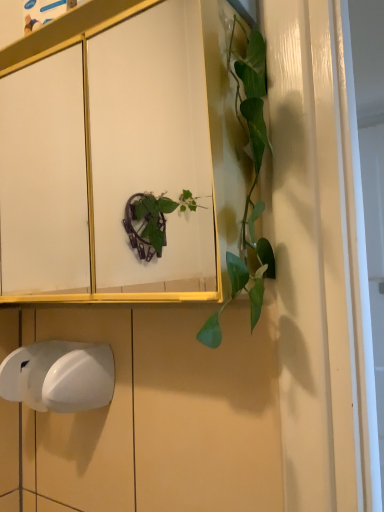
I want to click on white plastic hand dryer at lower left, so click(59, 376).

Describe the element at coordinates (59, 376) in the screenshot. I see `white plastic hand dryer at lower left` at that location.

What do you see at coordinates (108, 162) in the screenshot? I see `white glossy cabinet at upper center` at bounding box center [108, 162].

Locate an element on the screen. The image size is (384, 512). white glossy cabinet at upper center is located at coordinates (108, 162).

Find the location of `white plastic hand dryer at lower left`. white plastic hand dryer at lower left is located at coordinates (x=59, y=376).

Considering the relative positions of white glossy cabinet at upper center and white plastic hand dryer at lower left in the image provided, is white glossy cabinet at upper center to the left of white plastic hand dryer at lower left from the viewer's perspective?

No, white glossy cabinet at upper center is not to the left of white plastic hand dryer at lower left.

Considering the relative positions of white glossy cabinet at upper center and white plastic hand dryer at lower left in the image provided, is white glossy cabinet at upper center in front of white plastic hand dryer at lower left?

Yes, the depth of white glossy cabinet at upper center is less than that of white plastic hand dryer at lower left.

Is point (94, 34) behind point (48, 393)?

No, it is not.

From the image's perspective, is white glossy cabinet at upper center over white plastic hand dryer at lower left?

Correct, white glossy cabinet at upper center appears higher than white plastic hand dryer at lower left in the image.

From a real-world perspective, is white glossy cabinet at upper center positioned under white plastic hand dryer at lower left based on gravity?

No, from a real-world perspective, white glossy cabinet at upper center is not beneath white plastic hand dryer at lower left.

Consider the image. Can you confirm if white glossy cabinet at upper center is thinner than white plastic hand dryer at lower left?

No.

Can you confirm if white glossy cabinet at upper center is shorter than white plastic hand dryer at lower left?

Incorrect, the height of white glossy cabinet at upper center does not fall short of that of white plastic hand dryer at lower left.

Considering the relative sizes of white glossy cabinet at upper center and white plastic hand dryer at lower left in the image provided, is white glossy cabinet at upper center smaller than white plastic hand dryer at lower left?

No, white glossy cabinet at upper center is not smaller than white plastic hand dryer at lower left.

Do you think white glossy cabinet at upper center is within white plastic hand dryer at lower left, or outside of it?

The correct answer is: outside.

Is there a large distance between white glossy cabinet at upper center and white plastic hand dryer at lower left?

Indeed, white glossy cabinet at upper center is not near white plastic hand dryer at lower left.

Is white glossy cabinet at upper center looking in the opposite direction of white plastic hand dryer at lower left?

white glossy cabinet at upper center is not turned away from white plastic hand dryer at lower left.

Can you tell me how much white glossy cabinet at upper center and white plastic hand dryer at lower left differ in facing direction?

There is a 0.0367-degree angle between the facing directions of white glossy cabinet at upper center and white plastic hand dryer at lower left.

Where is `hand dryer behind the white glossy cabinet at upper center`? The image size is (384, 512). hand dryer behind the white glossy cabinet at upper center is located at coordinates (59, 376).

Considering the relative positions of white plastic hand dryer at lower left and white glossy cabinet at upper center in the image provided, is white plastic hand dryer at lower left to the right of white glossy cabinet at upper center from the viewer's perspective?

No.

In the image, is white plastic hand dryer at lower left positioned in front of or behind white glossy cabinet at upper center?

white plastic hand dryer at lower left is positioned farther from the viewer than white glossy cabinet at upper center.

Is point (53, 355) farther from camera compared to point (173, 29)?

No, it is in front of (173, 29).

From the image's perspective, is white plastic hand dryer at lower left located above or below white glossy cabinet at upper center?

Clearly, from the image's perspective, white plastic hand dryer at lower left is below white glossy cabinet at upper center.

From a real-world perspective, who is located higher, white plastic hand dryer at lower left or white glossy cabinet at upper center?

In real-world perspective, white glossy cabinet at upper center is above.

Consider the image. Does white plastic hand dryer at lower left have a greater width compared to white glossy cabinet at upper center?

No.

In terms of height, does white plastic hand dryer at lower left look taller or shorter compared to white glossy cabinet at upper center?

Clearly, white plastic hand dryer at lower left is shorter compared to white glossy cabinet at upper center.

Based on their sizes in the image, would you say white plastic hand dryer at lower left is bigger or smaller than white glossy cabinet at upper center?

white plastic hand dryer at lower left is smaller than white glossy cabinet at upper center.

Is white plastic hand dryer at lower left surrounding white glossy cabinet at upper center?

No, white glossy cabinet at upper center is not inside white plastic hand dryer at lower left.

Does white plastic hand dryer at lower left touch white glossy cabinet at upper center?

No.

Is white plastic hand dryer at lower left aimed at white glossy cabinet at upper center?

No, white plastic hand dryer at lower left is not oriented towards white glossy cabinet at upper center.

How distant is white plastic hand dryer at lower left from white glossy cabinet at upper center?

white plastic hand dryer at lower left is 1.04 meters away from white glossy cabinet at upper center.

Identify the location of cabinetry in front of the white plastic hand dryer at lower left. (108, 162).

At what (x,y) coordinates should I click in order to perform the action: click on hand dryer on the left of white glossy cabinet at upper center. Please return your answer as a coordinate pair (x, y). This screenshot has width=384, height=512. Looking at the image, I should click on (59, 376).

Locate an element on the screen. Image resolution: width=384 pixels, height=512 pixels. hand dryer beneath the white glossy cabinet at upper center (from a real-world perspective) is located at coordinates (59, 376).